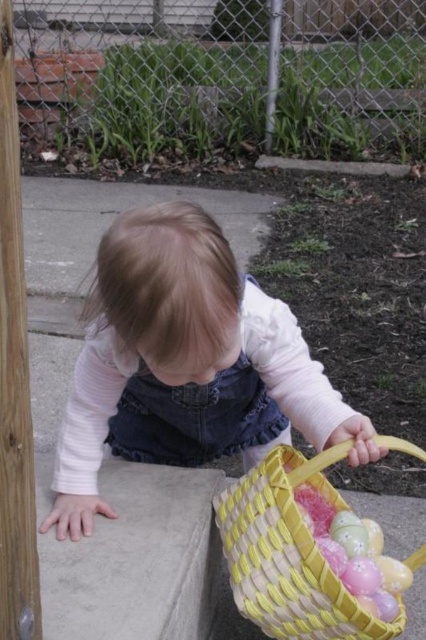
You are a photographer standing at a safe distance. You want to take a photo of the pink denim overalls at center without getting too close. What is the minimum distance you need to maintain to ensure the entire overalls are in frame?

The minimum distance you need to maintain is 31.93 inches to ensure the entire pink denim overalls at center are in frame.

You are a photographer trying to capture the pink denim overalls at center in the image. Given that the camera is focused on the point at coordinates point [181,353], will the pink denim overalls at center be in focus?

The point [181,353] corresponds to the pink denim overalls at center, so yes, the pink denim overalls at center will be in focus.

You are a parent trying to hand your child the yellow woven basket at lower right. If you are standing 3 feet away from the basket, will you be able to reach it without moving closer?

The yellow woven basket at lower right is 37.60 inches from the viewer. Since 3 feet equals 36 inches, the basket is 1.6 inches farther away than your reach. Therefore, you will not be able to reach it without moving closer.